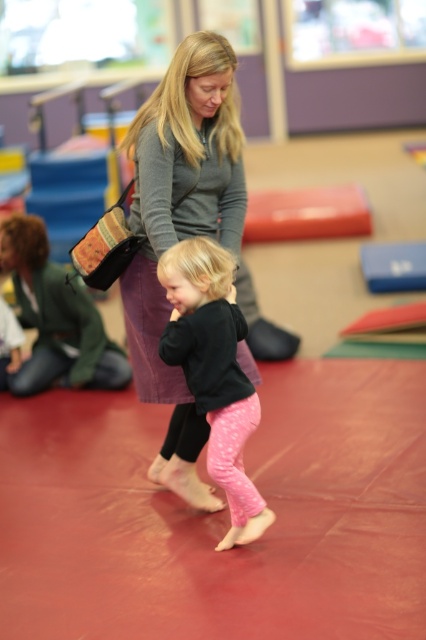
Question: Which object appears closest to the camera in this image?

Choices:
 (A) pink textured leggings at center
 (B) matte gray sweater at center

Answer: (A)

Question: Which point is farther from the camera taking this photo?

Choices:
 (A) (187, 340)
 (B) (143, 262)

Answer: (B)

Question: Which object appears closest to the camera in this image?

Choices:
 (A) pink textured leggings at center
 (B) matte gray sweater at center

Answer: (A)

Question: Does matte gray sweater at center have a greater width compared to pink textured leggings at center?

Choices:
 (A) yes
 (B) no

Answer: (A)

Question: Does matte gray sweater at center have a lesser width compared to pink textured leggings at center?

Choices:
 (A) no
 (B) yes

Answer: (A)

Question: Can you confirm if matte gray sweater at center is bigger than pink textured leggings at center?

Choices:
 (A) yes
 (B) no

Answer: (A)